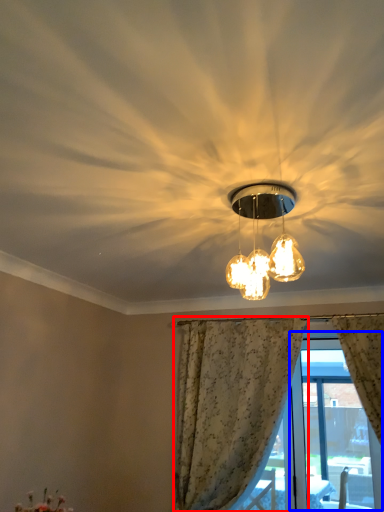
Question: Which object appears farthest to the camera in this image, curtain (highlighted by a red box) or window screen (highlighted by a blue box)?

Choices:
 (A) curtain
 (B) window screen

Answer: (B)